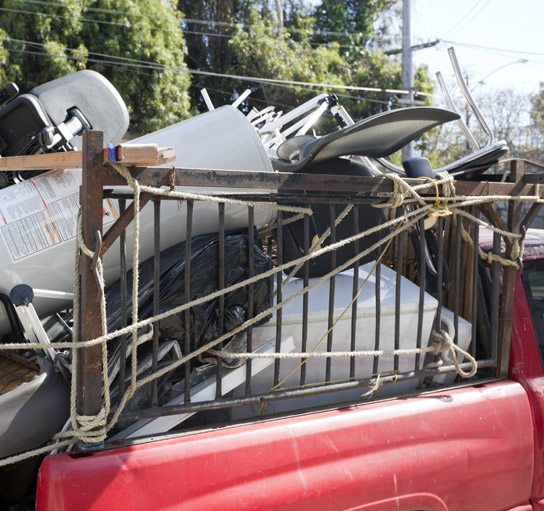
Locate an element on the screen. Image resolution: width=544 pixels, height=511 pixels. chair is located at coordinates (378, 138).